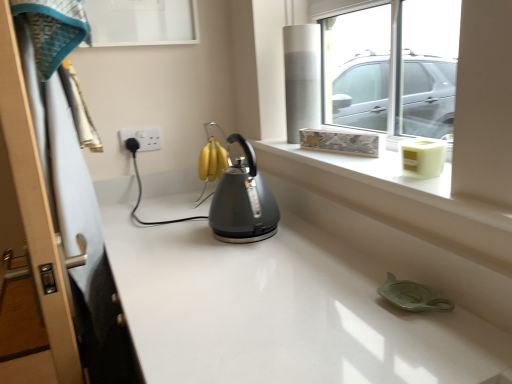
Question: Does transparent glass window at upper center contain satin grey kettle at center?

Choices:
 (A) yes
 (B) no

Answer: (B)

Question: Is transparent glass window at upper center to the right of satin grey kettle at center from the viewer's perspective?

Choices:
 (A) no
 (B) yes

Answer: (B)

Question: Is the position of transparent glass window at upper center more distant than that of satin grey kettle at center?

Choices:
 (A) yes
 (B) no

Answer: (B)

Question: Is the depth of transparent glass window at upper center less than that of satin grey kettle at center?

Choices:
 (A) yes
 (B) no

Answer: (A)

Question: From the image's perspective, would you say transparent glass window at upper center is shown under satin grey kettle at center?

Choices:
 (A) no
 (B) yes

Answer: (A)

Question: Is satin grey kettle at center taller or shorter than white textured ledge at upper right?

Choices:
 (A) tall
 (B) short

Answer: (A)

Question: From a real-world perspective, is satin grey kettle at center physically located above or below white textured ledge at upper right?

Choices:
 (A) above
 (B) below

Answer: (B)

Question: Is satin grey kettle at center bigger or smaller than white textured ledge at upper right?

Choices:
 (A) big
 (B) small

Answer: (A)

Question: Considering the positions of satin grey kettle at center and white textured ledge at upper right in the image, is satin grey kettle at center wider or thinner than white textured ledge at upper right?

Choices:
 (A) wide
 (B) thin

Answer: (B)

Question: Is transparent glass window at upper center bigger or smaller than satin grey kettle at center?

Choices:
 (A) big
 (B) small

Answer: (A)

Question: Choose the correct answer: Is transparent glass window at upper center inside satin grey kettle at center or outside it?

Choices:
 (A) outside
 (B) inside

Answer: (A)

Question: From a real-world perspective, is transparent glass window at upper center above or below satin grey kettle at center?

Choices:
 (A) above
 (B) below

Answer: (A)

Question: In terms of width, does transparent glass window at upper center look wider or thinner when compared to satin grey kettle at center?

Choices:
 (A) wide
 (B) thin

Answer: (B)

Question: Looking at the image, does satin grey kettle at center seem bigger or smaller compared to white plastic socket at upper left?

Choices:
 (A) small
 (B) big

Answer: (B)

Question: Considering the positions of point (248, 147) and point (120, 135), is point (248, 147) closer or farther from the camera than point (120, 135)?

Choices:
 (A) closer
 (B) farther

Answer: (A)